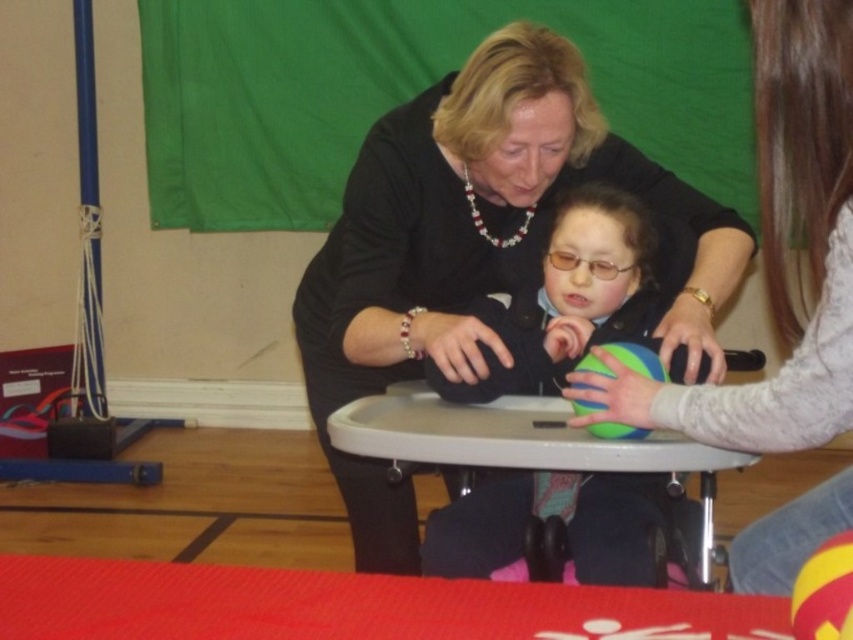
You are a child who wants to pick up the matte blue ball at center and the yellow rubber ball at center from the table. Which ball should you pick up first to get both?

You should pick up the matte blue ball at center first because it is positioned over the yellow rubber ball at center, so you need to move the top one before accessing the one below.